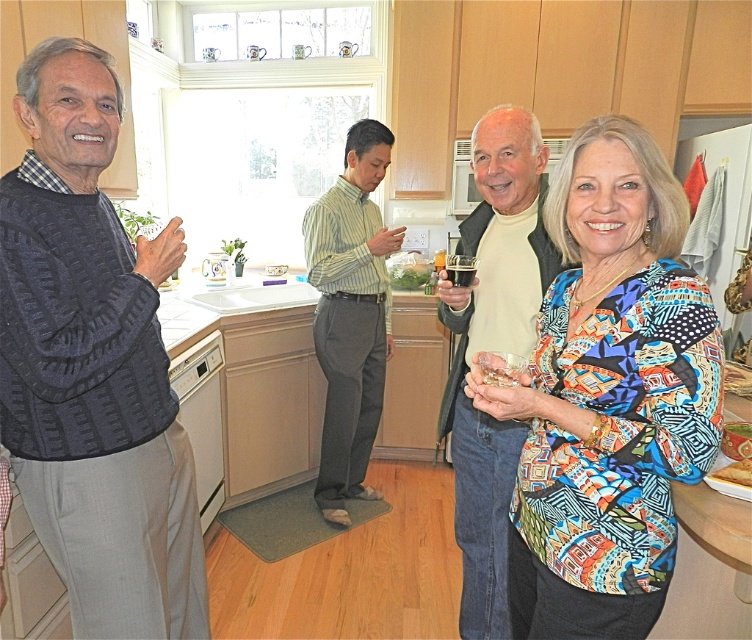
Question: Which is nearer to the knitted dark gray sweater at left?

Choices:
 (A) translucent glass at center
 (B) white plastic dishwasher at lower left

Answer: (A)

Question: Among these objects, which one is farthest from the camera?

Choices:
 (A) white plastic dishwasher at lower left
 (B) knitted dark gray sweater at left

Answer: (A)

Question: Which point is farther to the camera?

Choices:
 (A) (511, 116)
 (B) (470, 388)

Answer: (A)

Question: Is golden crispy bread at lower right positioned at the back of translucent glass at center?

Choices:
 (A) yes
 (B) no

Answer: (B)

Question: Is light beige sweater at center wider than green striped shirt at center?

Choices:
 (A) yes
 (B) no

Answer: (B)

Question: Is green striped shirt at center thinner than golden crispy bread at lower right?

Choices:
 (A) no
 (B) yes

Answer: (A)